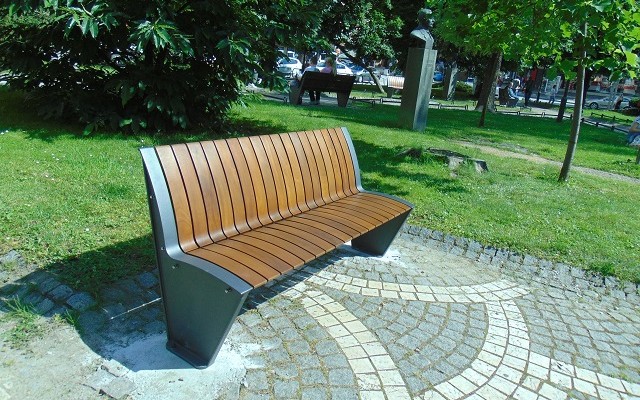
Locate an element on the screen. This screenshot has height=400, width=640. statue is located at coordinates (x=420, y=23).